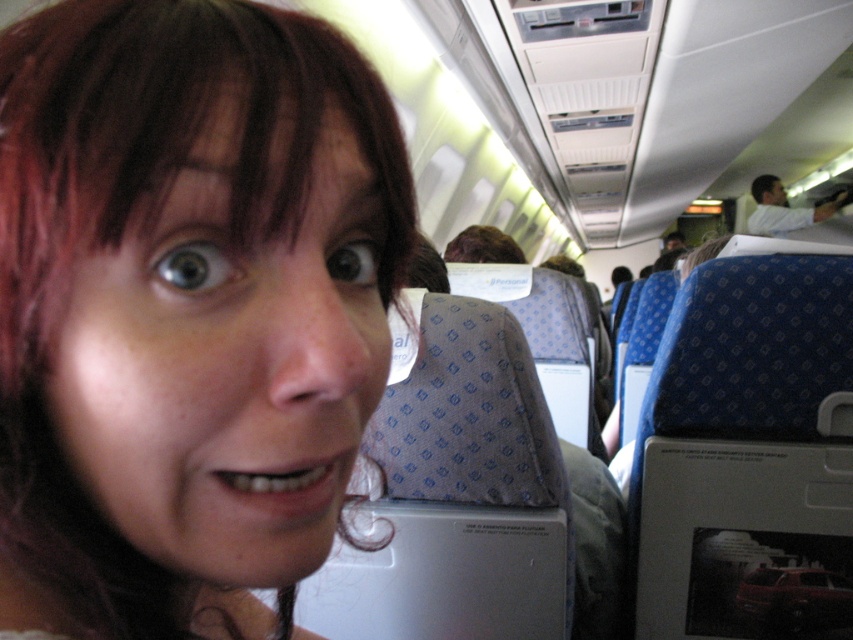
Is matte white shirt at upper right positioned before brown fuzzy hair at center?

No, it is not.

Does matte white shirt at upper right have a lesser height compared to brown fuzzy hair at center?

No, matte white shirt at upper right is not shorter than brown fuzzy hair at center.

Is point (762, 198) positioned after point (494, 241)?

Yes, point (762, 198) is farther from viewer.

In order to click on matte white shirt at upper right in this screenshot , I will do `click(782, 209)`.

Is matte skin face at center to the right of brown fuzzy hair at center from the viewer's perspective?

Incorrect, matte skin face at center is not on the right side of brown fuzzy hair at center.

Is the position of matte skin face at center less distant than that of brown fuzzy hair at center?

Yes, it is.

Between point (218, 220) and point (468, 236), which one is positioned behind?

Positioned behind is point (468, 236).

Locate an element on the screen. The height and width of the screenshot is (640, 853). matte skin face at center is located at coordinates (184, 308).

Can you confirm if matte skin face at center is shorter than matte white shirt at upper right?

Yes, matte skin face at center is shorter than matte white shirt at upper right.

Can you confirm if matte skin face at center is positioned below matte white shirt at upper right?

Correct, matte skin face at center is located below matte white shirt at upper right.

Which is in front, point (16, 260) or point (828, 204)?

Positioned in front is point (16, 260).

Where is `matte skin face at center`? This screenshot has width=853, height=640. matte skin face at center is located at coordinates (184, 308).